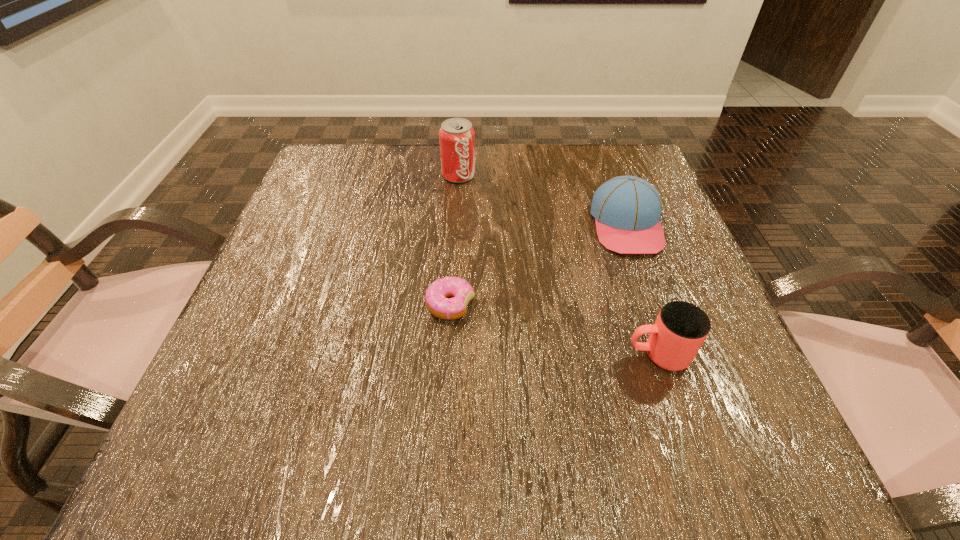
Locate an element on the screen. The width and height of the screenshot is (960, 540). empty location between the soda can and the baseball cap is located at coordinates (542, 200).

The height and width of the screenshot is (540, 960). What are the coordinates of `free space between the third nearest object and the shortest object` in the screenshot? It's located at (539, 265).

This screenshot has width=960, height=540. Identify the location of free space between the baseball cap and the nearest object. (642, 290).

Image resolution: width=960 pixels, height=540 pixels. I want to click on free space between the soda can and the cup, so click(x=558, y=265).

Identify the location of object identified as the closest to the second farthest object. (681, 328).

At what (x,y) coordinates should I click in order to perform the action: click on object that is the second closest to the shortest object. Please return your answer as a coordinate pair (x, y). The image size is (960, 540). Looking at the image, I should click on (627, 209).

This screenshot has width=960, height=540. I want to click on vacant space that satisfies the following two spatial constraints: 1. on the handle side of the cup; 2. on the front side of the third farthest object, so click(x=641, y=305).

Where is `free space that satisfies the following two spatial constraints: 1. on the back side of the farthest object; 2. on the right side of the third farthest object`? free space that satisfies the following two spatial constraints: 1. on the back side of the farthest object; 2. on the right side of the third farthest object is located at coordinates (458, 176).